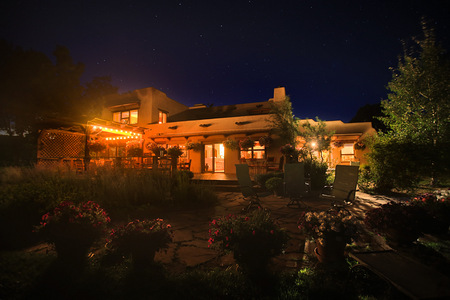
The height and width of the screenshot is (300, 450). Find the location of `door`. door is located at coordinates (219, 160).